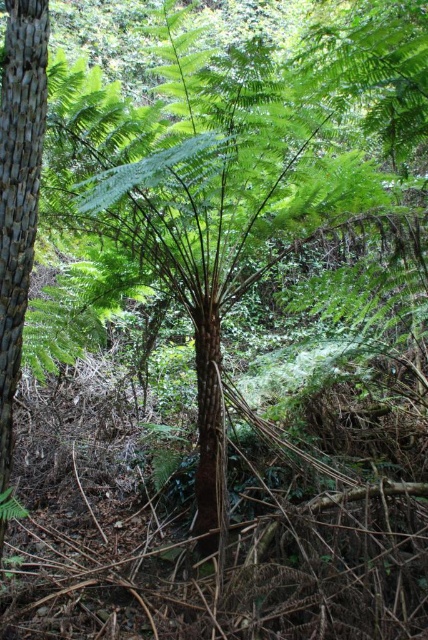
In the scene shown: You are a hiker who just entered the forest and see the wooden textured pole at left and the brown rough tree trunk at center. Which object is closer to you?

The wooden textured pole at left is closer to you because it is in front of the brown rough tree trunk at center.